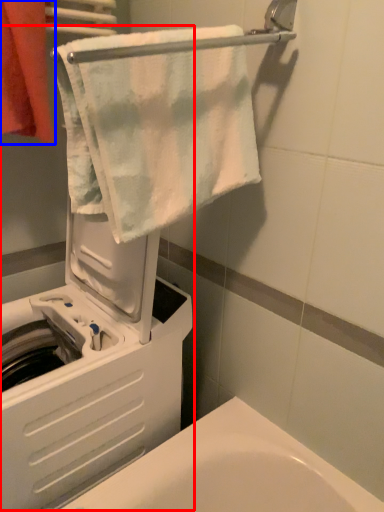
Question: Which of the following is the farthest to the observer, machine (highlighted by a red box) or towel (highlighted by a blue box)?

Choices:
 (A) machine
 (B) towel

Answer: (B)